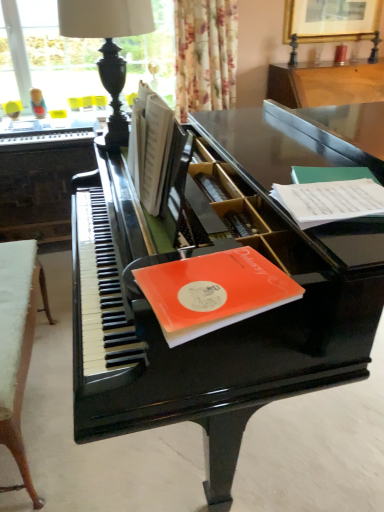
Where is `empty space that is ontop of white paper at right, the second paperback book positioned from the left (from a real-world perspective)`? empty space that is ontop of white paper at right, the second paperback book positioned from the left (from a real-world perspective) is located at coordinates (326, 188).